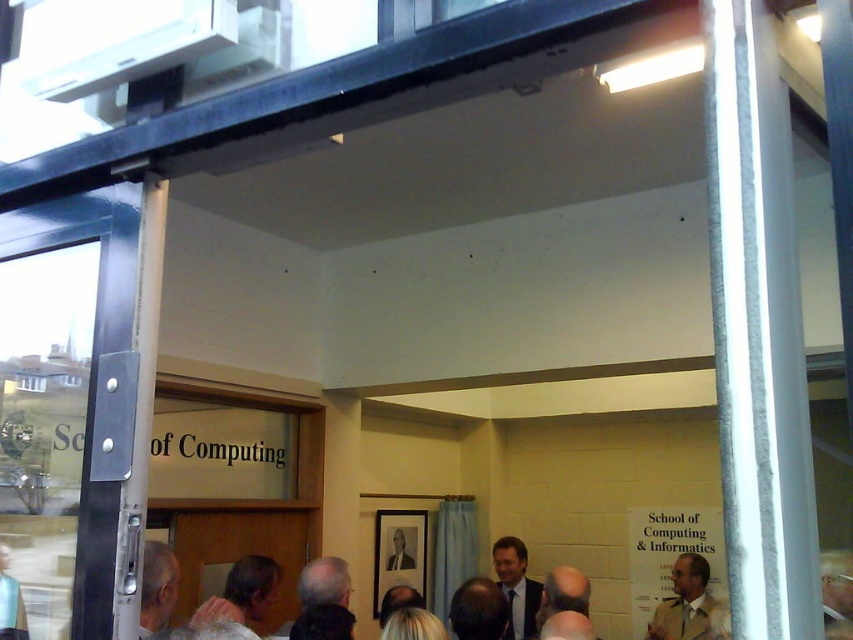
You are a photographer taking a picture of the scene. You notice two areas with gray hair at center and gray hair at lower left. Which area should you focus on if you want to capture the subject closer to the bottom of the frame?

You should focus on the gray hair at center because it is below the gray hair at lower left, making it closer to the bottom of the frame.

You are standing in the conference room and want to determine the relative positions of two points marked on the wall. The first point is at coordinates point (259, 602) and the second is at point (164, 609). Which point is closer to you?

Point (164, 609) is closer to you because it is nearer to the camera compared to point (259, 602), which is further away.